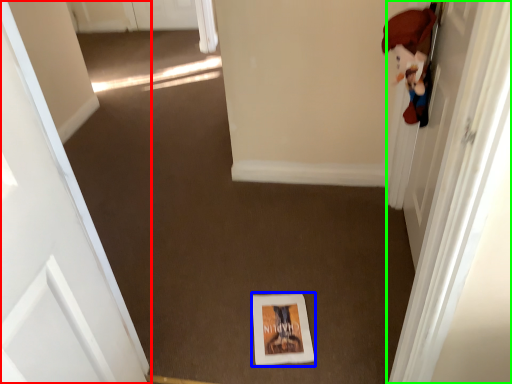
Question: Which object is the farthest from door (highlighted by a red box)? Choose among these: print (highlighted by a blue box) or door (highlighted by a green box).

Choices:
 (A) print
 (B) door

Answer: (B)